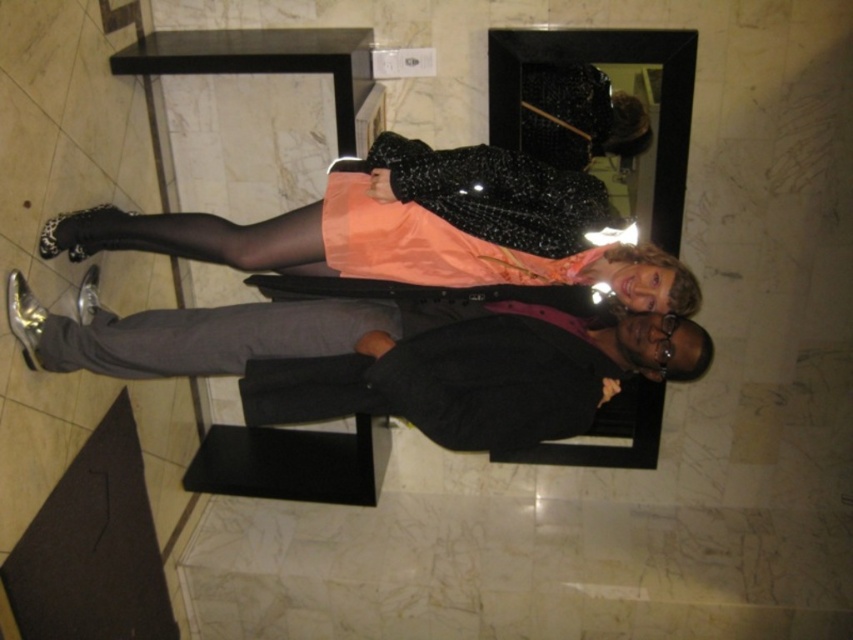
You are standing in the hotel lobby and want to place a small decorative item between the two points, point [73,342] and point [460,225]. Which point should the item be closer to in order to be nearer to the viewer?

The small decorative item should be placed closer to point [73,342] because it is closer to the viewer than point [460,225].

You are a photographer setting up for a photo shoot in a marble floored lobby. You have two props to place between the two people. The matte orange dress at center and the gray smooth pants at lower center. The rule is that taller objects must be placed behind shorter ones to avoid blocking views. Which prop should go behind the other?

The matte orange dress at center is taller than the gray smooth pants at lower center, so the matte orange dress at center should be placed behind the gray smooth pants at lower center to avoid blocking the view.

You are standing in the hotel lobby and see a point marked at coordinates (459, 216). Based on the scene description, can you identify what object this point is located on?

The point at coordinates (459, 216) is located on the matte orange dress at center.